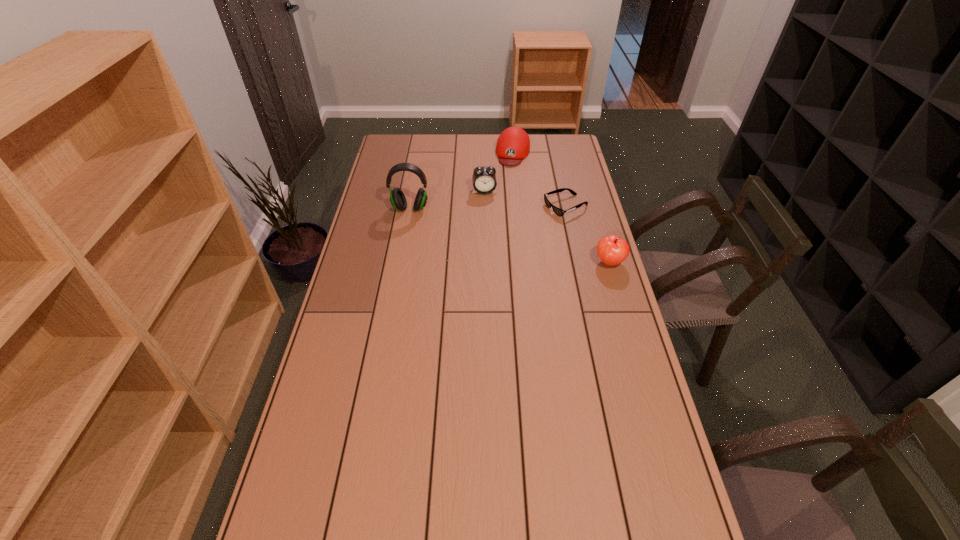
Find the location of a particular element. This screenshot has width=960, height=540. free space between the second object from left to right and the shortest object is located at coordinates (525, 199).

At what (x,y) coordinates should I click in order to perform the action: click on free point between the nearest object and the headset. Please return your answer as a coordinate pair (x, y). Looking at the image, I should click on (510, 235).

Find the location of a particular element. This screenshot has height=540, width=960. vacant space that is in between the fourth object from right to left and the sunglasses is located at coordinates point(525,199).

At what (x,y) coordinates should I click in order to perform the action: click on empty location between the fourth object from right to left and the nearest object. Please return your answer as a coordinate pair (x, y). Looking at the image, I should click on (547, 227).

Find the location of `unoccupied position between the sunglasses and the alarm clock`. unoccupied position between the sunglasses and the alarm clock is located at coordinates (525, 199).

You are a GUI agent. You are given a task and a screenshot of the screen. Output one action in this format:
    pyautogui.click(x=<x>, y=<y>)
    Task: Click on the free point between the nearest object and the sunglasses
    Image resolution: width=960 pixels, height=540 pixels.
    Given the screenshot: What is the action you would take?
    pyautogui.click(x=588, y=234)

In order to click on object that is the fourth closest to the tallest object in this screenshot , I will do `click(612, 250)`.

At what (x,y) coordinates should I click in order to perform the action: click on the closest object to the tallest object. Please return your answer as a coordinate pair (x, y). The image size is (960, 540). Looking at the image, I should click on (484, 179).

At what (x,y) coordinates should I click in order to perform the action: click on vacant point that satisfies the following two spatial constraints: 1. on the ear cups of the leftmost object; 2. on the right side of the nearest object. Please return your answer as a coordinate pair (x, y). Looking at the image, I should click on (400, 262).

Image resolution: width=960 pixels, height=540 pixels. I want to click on vacant region that satisfies the following two spatial constraints: 1. on the front side of the second object from left to right; 2. on the right side of the apple, so click(x=486, y=262).